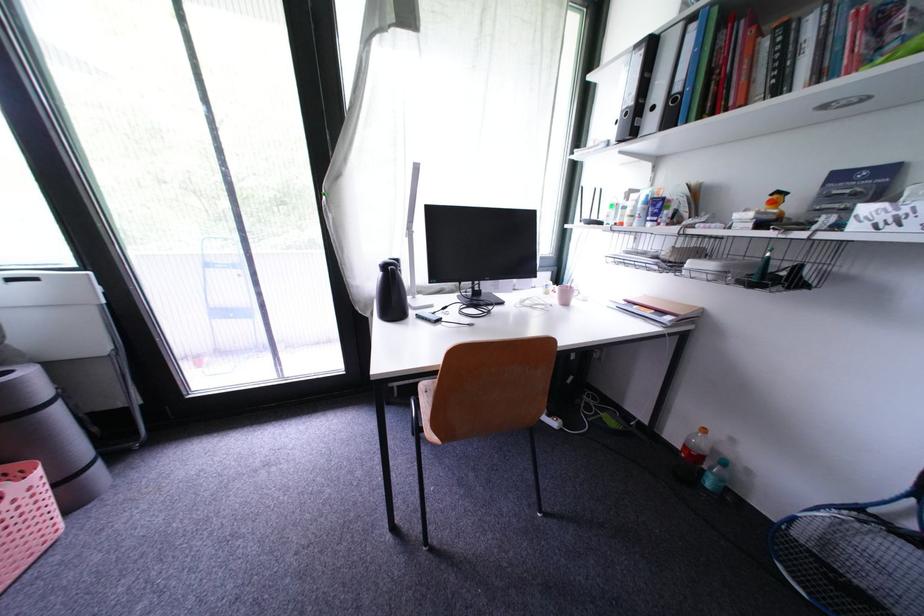
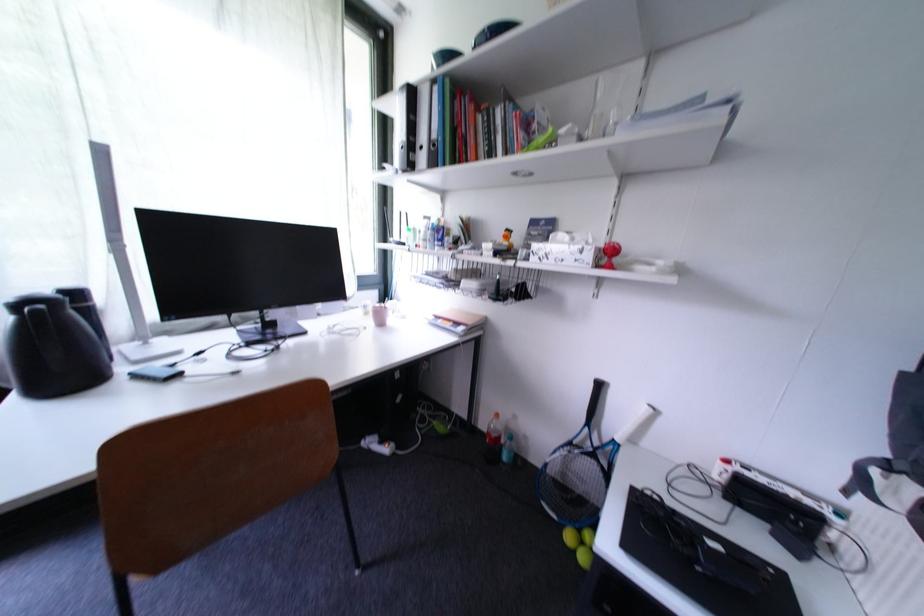
The point at (554,294) is marked in the first image. Where is the corresponding point in the second image?

(373, 315)